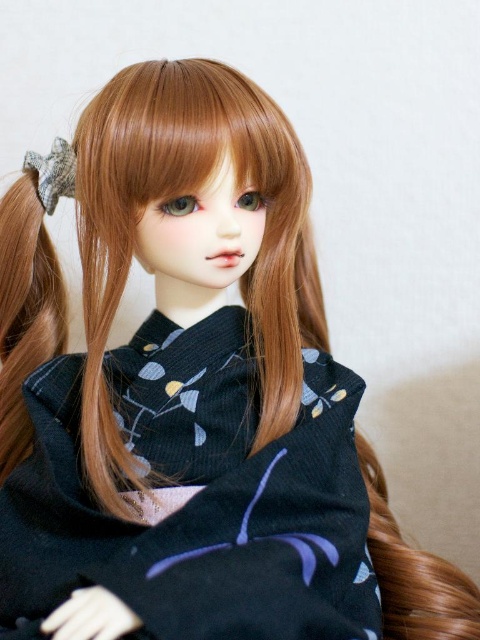
Is point (298, 424) positioned after point (429, 628)?

Yes, point (298, 424) is farther from viewer.

What do you see at coordinates (195, 497) in the screenshot? I see `dark blue corduroy robe at center` at bounding box center [195, 497].

The width and height of the screenshot is (480, 640). Identify the location of dark blue corduroy robe at center. [195, 497].

Where is `dark blue corduroy robe at center`? dark blue corduroy robe at center is located at coordinates (195, 497).

Between dark blue corduroy robe at center and light brown silky hair at left, which one has less height?

dark blue corduroy robe at center

Between point (296, 532) and point (16, 232), which one is positioned in front?

Point (296, 532) is more forward.

The image size is (480, 640). In order to click on dark blue corduroy robe at center in this screenshot , I will do `click(195, 497)`.

Which is behind, point (443, 588) or point (61, 148)?

Point (61, 148)

Is point (384, 579) farther from camera compared to point (35, 156)?

That is False.

I want to click on brown silky hair at lower right, so (412, 573).

Locate an element on the screen. The image size is (480, 640). brown silky hair at lower right is located at coordinates (412, 573).